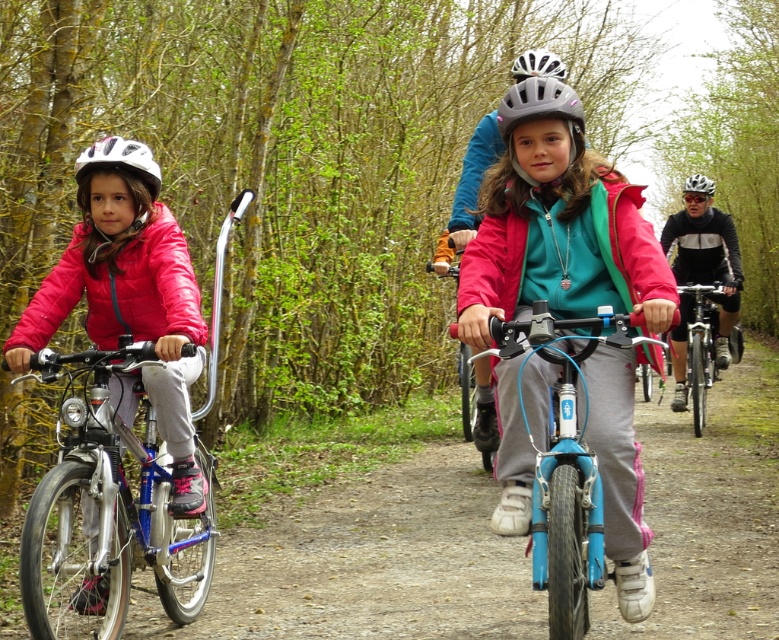
You are a photographer trying to capture a shot of the brushed metal bicycle at left and the matte black helmet at center. Based on their positions, which object should you focus on first to ensure both are in frame?

The brushed metal bicycle at left is below the matte black helmet at center, so focusing on the helmet first will allow you to adjust the camera angle downward to include the bicycle in the frame.

You are a photographer trying to capture the children riding their bicycles. You notice the brushed metal bicycle at left and the matte black helmet at center. Which object is shorter in height?

The brushed metal bicycle at left is shorter in height than the matte black helmet at center because the brushed metal bicycle at left is not as tall as matte black helmet at center.